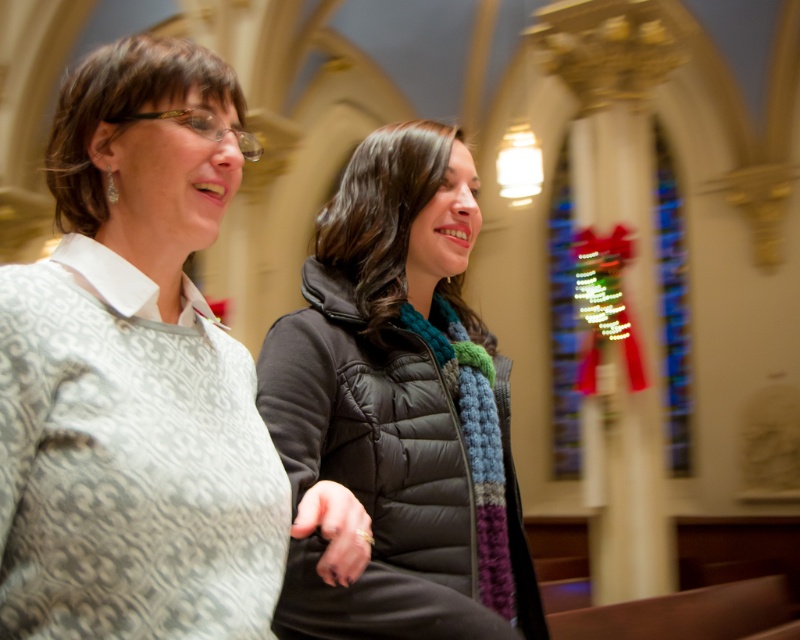
You are an interior designer assessing the seating arrangement in a church. You notice the patterned fabric shirt at left and the black quilted jacket at center. Which clothing item is closer to the front row?

The patterned fabric shirt at left is shorter than the black quilted jacket at center, meaning it is closer to the front row since shorter items are typically positioned nearer in such settings.

You are an interior designer assessing the seating arrangement in the church. You need to determine if the patterned fabric shirt at left and the black quilted jacket at center can sit side by side on a bench that is 1.2 meters wide. Can they fit without overlapping?

The patterned fabric shirt at left is narrower than the black quilted jacket at center. If the combined width of both is less than 1.2 meters, they can fit. However, since the exact widths aren